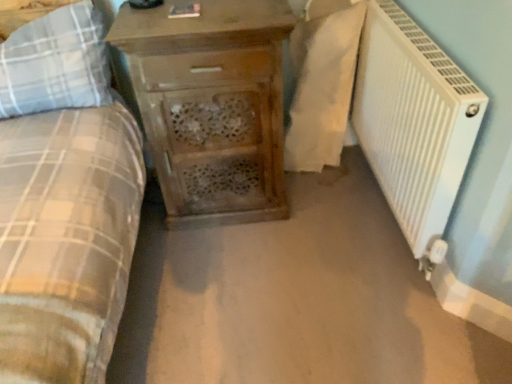
Question: Should I look upward or downward to see white textured radiator at right?

Choices:
 (A) up
 (B) down

Answer: (A)

Question: Can you confirm if white fabric at right is wider than plaid fabric pillow at left?

Choices:
 (A) no
 (B) yes

Answer: (A)

Question: Can you confirm if white fabric at right is bigger than plaid fabric pillow at left?

Choices:
 (A) no
 (B) yes

Answer: (B)

Question: From the image's perspective, would you say white fabric at right is shown under plaid fabric pillow at left?

Choices:
 (A) yes
 (B) no

Answer: (B)

Question: Considering the relative positions of white fabric at right and plaid fabric pillow at left in the image provided, is white fabric at right to the right of plaid fabric pillow at left from the viewer's perspective?

Choices:
 (A) yes
 (B) no

Answer: (A)

Question: Is there a large distance between white fabric at right and plaid fabric pillow at left?

Choices:
 (A) yes
 (B) no

Answer: (B)

Question: Does white fabric at right lie in front of plaid fabric pillow at left?

Choices:
 (A) yes
 (B) no

Answer: (B)

Question: Can white fabric at right be found inside wooden chest of drawers at center?

Choices:
 (A) no
 (B) yes

Answer: (A)

Question: From the image's perspective, is wooden chest of drawers at center beneath white fabric at right?

Choices:
 (A) no
 (B) yes

Answer: (B)

Question: Is wooden chest of drawers at center to the left of white fabric at right from the viewer's perspective?

Choices:
 (A) yes
 (B) no

Answer: (A)

Question: Does wooden chest of drawers at center have a lesser width compared to white fabric at right?

Choices:
 (A) yes
 (B) no

Answer: (B)

Question: Is wooden chest of drawers at center taller than white fabric at right?

Choices:
 (A) no
 (B) yes

Answer: (B)

Question: Is wooden chest of drawers at center bigger than white fabric at right?

Choices:
 (A) yes
 (B) no

Answer: (A)

Question: Would you say white textured radiator at right contains wooden chest of drawers at center?

Choices:
 (A) yes
 (B) no

Answer: (B)